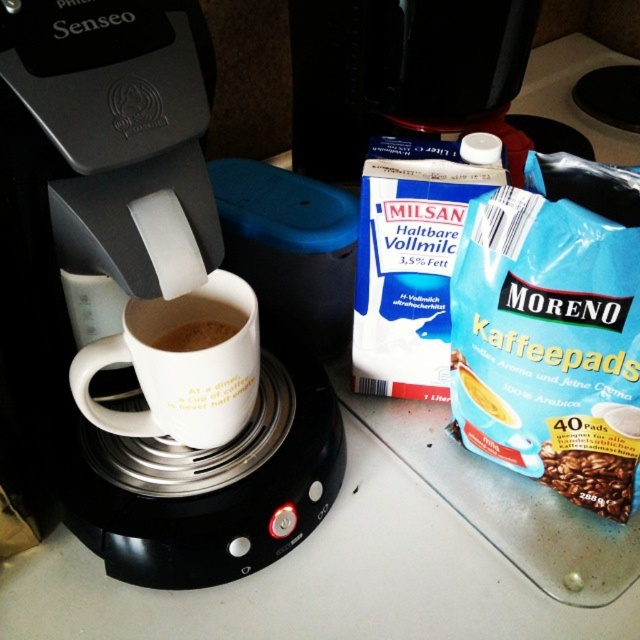
Based on the photo, you are a barista preparing a coffee order. You need to place the brown matte coffee beans at lower right and the brown matte mug at center on the counter. Which object should you place first if you want to ensure the larger item is closer to the edge of the counter?

The brown matte coffee beans at lower right is bigger than the brown matte mug at center, so you should place the brown matte coffee beans at lower right first to ensure the larger item is closer to the edge of the counter.

You are setting up a small kitchen display and need to place the black plastic coffee machine at center and the white matte mug at center on a shelf. If the shelf has limited vertical space, which object should you prioritize placing first to ensure both fit?

The white matte mug at center should be placed first since the black plastic coffee machine at center is taller. By placing the taller object first, you can ensure there is enough space left for the shorter mug.